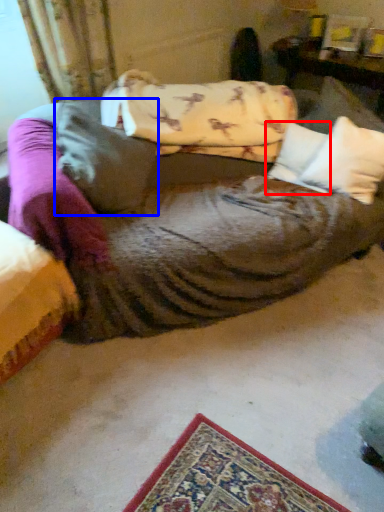
Question: Which object appears closest to the camera in this image, pillow (highlighted by a red box) or pillow (highlighted by a blue box)?

Choices:
 (A) pillow
 (B) pillow

Answer: (B)